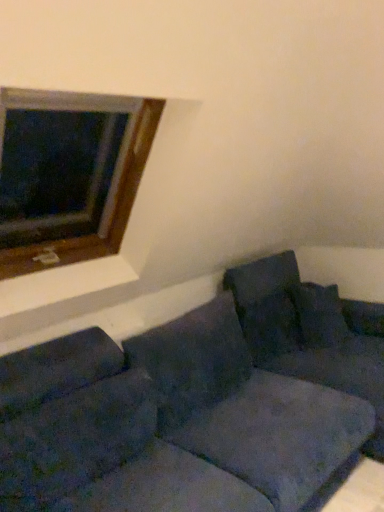
Question: Is velvet dark blue pillow at right, which is the 3th pillow from left to right, bigger than wooden frame at upper left?

Choices:
 (A) no
 (B) yes

Answer: (A)

Question: Is velvet dark blue pillow at right, which is the 3th pillow from left to right, surrounding wooden frame at upper left?

Choices:
 (A) no
 (B) yes

Answer: (A)

Question: Is velvet dark blue pillow at right, which is the 3th pillow from left to right, touching wooden frame at upper left?

Choices:
 (A) no
 (B) yes

Answer: (A)

Question: Is velvet dark blue pillow at right, which ranks as the first pillow in right-to-left order, further to the viewer compared to wooden frame at upper left?

Choices:
 (A) no
 (B) yes

Answer: (B)

Question: From a real-world perspective, is velvet dark blue pillow at right, which ranks as the first pillow in right-to-left order, located beneath wooden frame at upper left?

Choices:
 (A) yes
 (B) no

Answer: (A)

Question: Is wooden frame at upper left inside the boundaries of velvety dark blue pillow at center, the second pillow from the right, or outside?

Choices:
 (A) inside
 (B) outside

Answer: (B)

Question: Considering the relative positions of wooden frame at upper left and velvety dark blue pillow at center, the 2th pillow viewed from the left, in the image provided, is wooden frame at upper left to the left or to the right of velvety dark blue pillow at center, the 2th pillow viewed from the left,?

Choices:
 (A) right
 (B) left

Answer: (B)

Question: Looking at their shapes, would you say wooden frame at upper left is wider or thinner than velvety dark blue pillow at center, the second pillow from the right?

Choices:
 (A) wide
 (B) thin

Answer: (A)

Question: In the image, is wooden frame at upper left positioned in front of or behind velvety dark blue pillow at center, the 2th pillow viewed from the left?

Choices:
 (A) front
 (B) behind

Answer: (A)

Question: From a real-world perspective, is velvet dark blue pillow at right, which is the 3th pillow from left to right, above or below velvety dark blue pillow at center, the second pillow from the right?

Choices:
 (A) above
 (B) below

Answer: (A)

Question: Is point (337, 312) closer or farther from the camera than point (253, 332)?

Choices:
 (A) closer
 (B) farther

Answer: (B)

Question: Looking at the image, does velvet dark blue pillow at right, which ranks as the first pillow in right-to-left order, seem bigger or smaller compared to velvety dark blue pillow at center, the second pillow from the right?

Choices:
 (A) big
 (B) small

Answer: (A)

Question: From the image's perspective, is velvet dark blue pillow at right, which is the 3th pillow from left to right, located above or below velvety dark blue pillow at center, the second pillow from the right?

Choices:
 (A) above
 (B) below

Answer: (A)

Question: From the image's perspective, is velvety dark blue pillow at center, the 2th pillow viewed from the left, above or below wooden frame at upper left?

Choices:
 (A) below
 (B) above

Answer: (A)

Question: Considering the positions of velvety dark blue pillow at center, the second pillow from the right, and wooden frame at upper left in the image, is velvety dark blue pillow at center, the second pillow from the right, wider or thinner than wooden frame at upper left?

Choices:
 (A) wide
 (B) thin

Answer: (B)